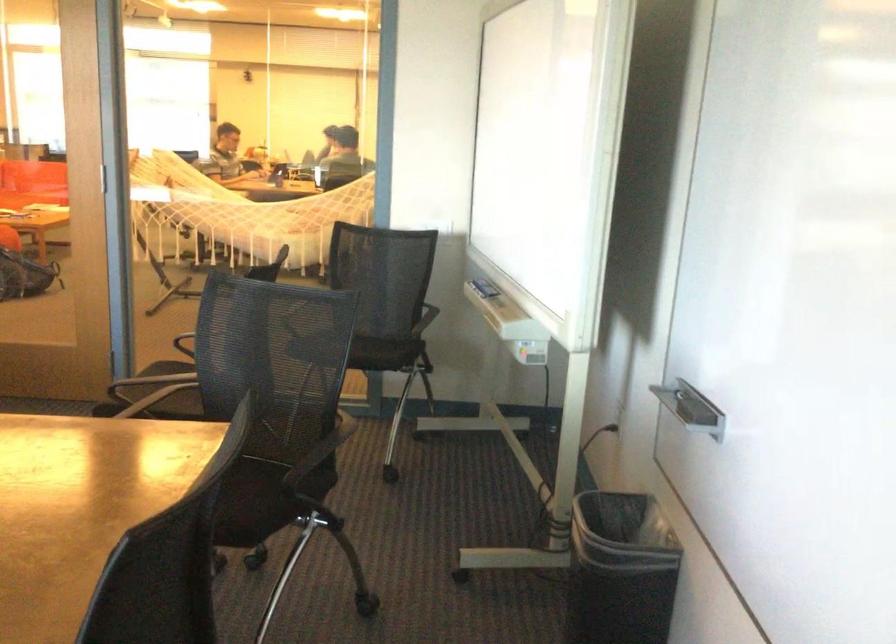
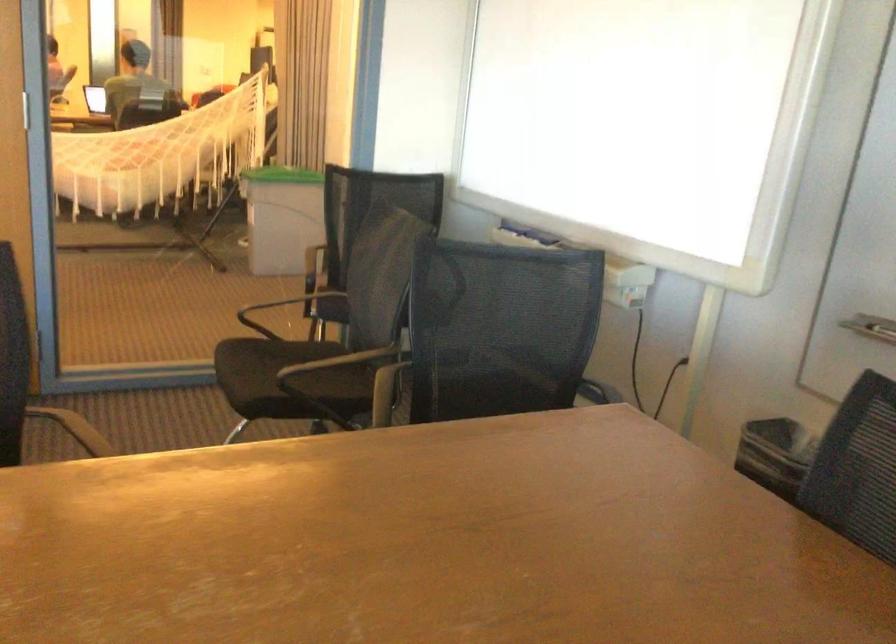
Question: I am providing you with two images of the same scene from different viewpoints. After the viewpoint changes to image2, which objects are now occluded?

Choices:
 (A) chair sitting surface
 (B) black drawing tablet
 (C) green trash can lid
 (D) black chair armrest

Answer: (A)